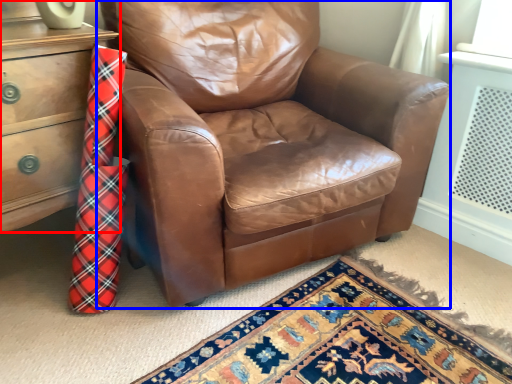
Question: Among these objects, which one is farthest to the camera, chest of drawers (highlighted by a red box) or chair (highlighted by a blue box)?

Choices:
 (A) chest of drawers
 (B) chair

Answer: (A)